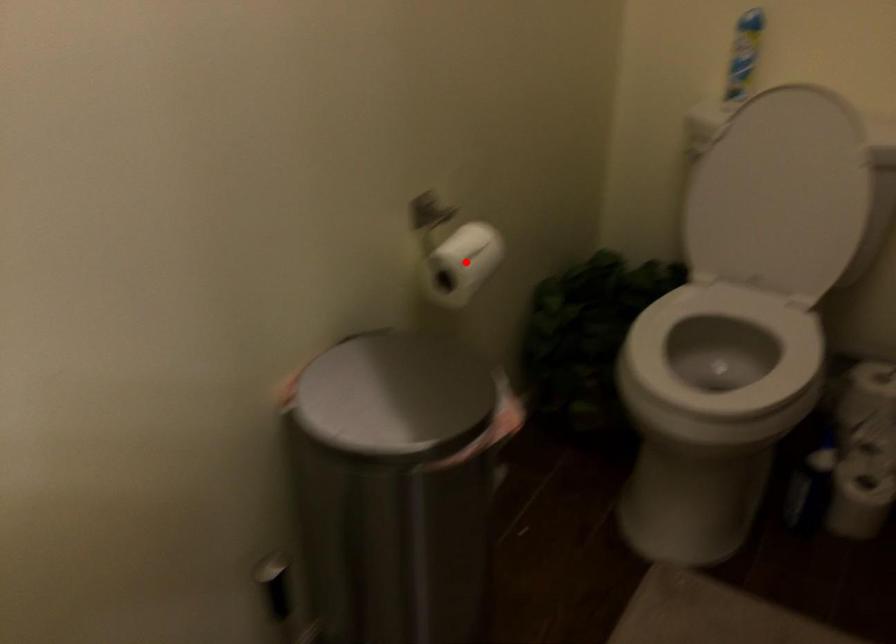
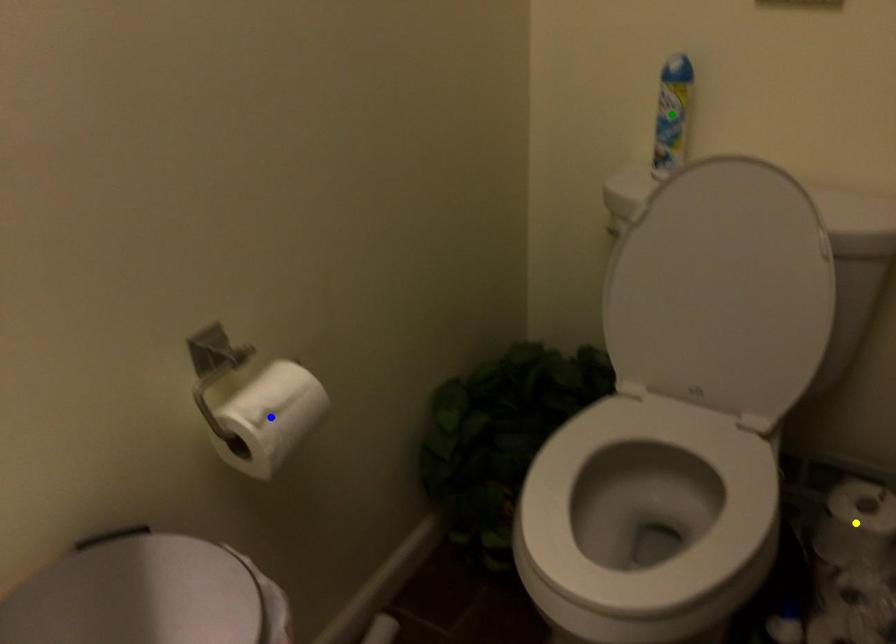
Question: I am providing you with two images of the same scene from different viewpoints. A red point is marked on the first image. You are given multiple points on the second image. Which spot in image 2 lines up with the point in image 1?

Choices:
 (A) yellow point
 (B) green point
 (C) blue point

Answer: (C)